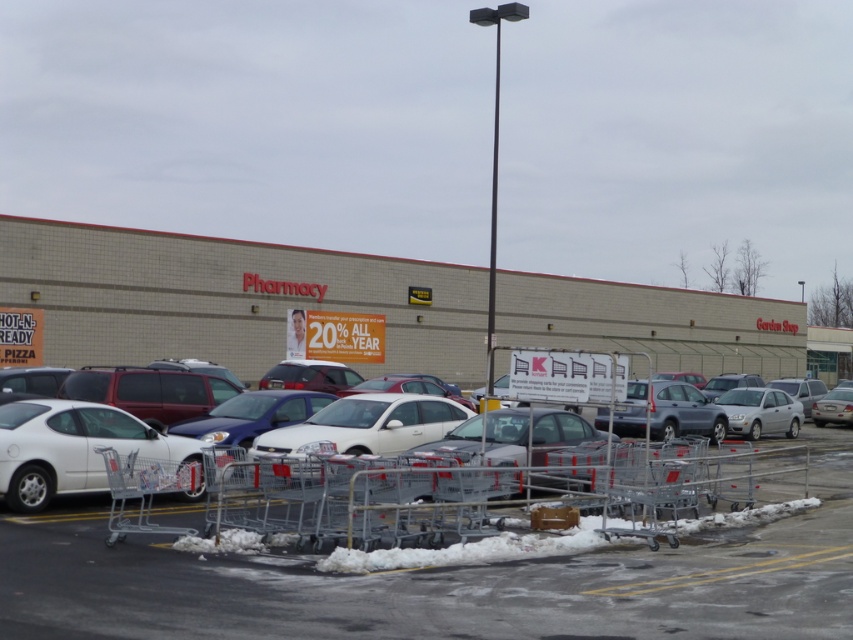
You are standing at the entrance of the retail store and want to park your car in the parking lot. The parking spot you want is at point 0.5, 0.5. Can you reach it without moving the silver metallic sedan at center?

The silver metallic sedan at center is located at point [683,412], which is not blocking the path to the parking spot at [426,320]. Therefore, you can reach it without moving the car.

You are standing in the parking lot of the retail store and see the white matte car at left. Where exactly is it located? Please provide coordinates in the format of point followed by numbers like point [73,448].

The white matte car at left is located at point [73,448].